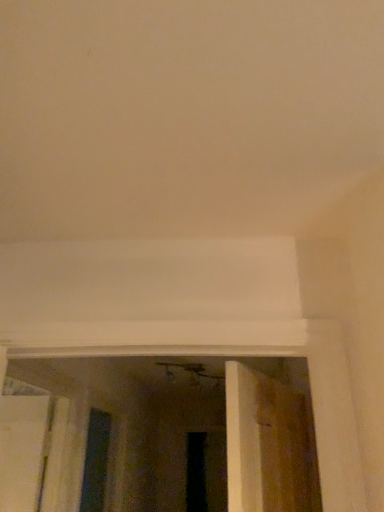
Describe the element at coordinates (196, 473) in the screenshot. This screenshot has width=384, height=512. I see `black glass screen door at lower center` at that location.

Where is `black glass screen door at lower center`? black glass screen door at lower center is located at coordinates [x=196, y=473].

Find the location of a particular element. black glass screen door at lower center is located at coordinates (196, 473).